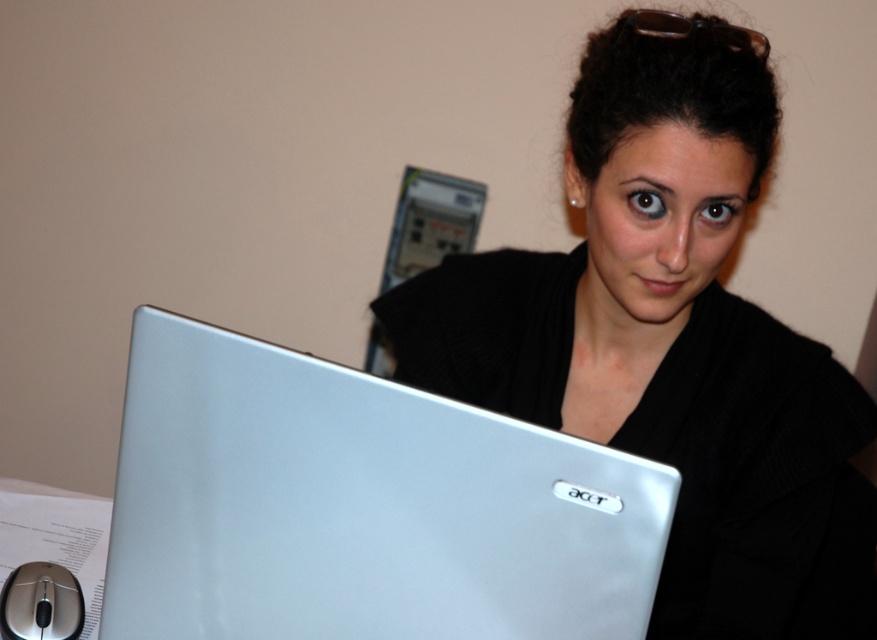
You are setting up a workspace and need to place both the matte silver laptop at center and the silver metallic laptop at center on a desk. According to the image, which laptop is placed on top of the other?

The matte silver laptop at center is positioned over silver metallic laptop at center, so the matte silver laptop at center is placed on top of the silver metallic laptop at center.

Looking at this image, you are setting up a workspace and need to place both the silver metallic laptop at center and the silver metallic mouse at lower left on a desk. Given that the desk has limited space, which object will require more area to accommodate?

The silver metallic laptop at center requires more area to accommodate because it is bigger than the silver metallic mouse at lower left.

You are organizing your desk and need to place a new keyboard between the matte silver laptop at center and the silver metallic mouse at lower left. Based on their positions, which side of the laptop should the keyboard be placed?

The keyboard should be placed to the left of the matte silver laptop at center since the silver metallic mouse at lower left is already positioned to its left.